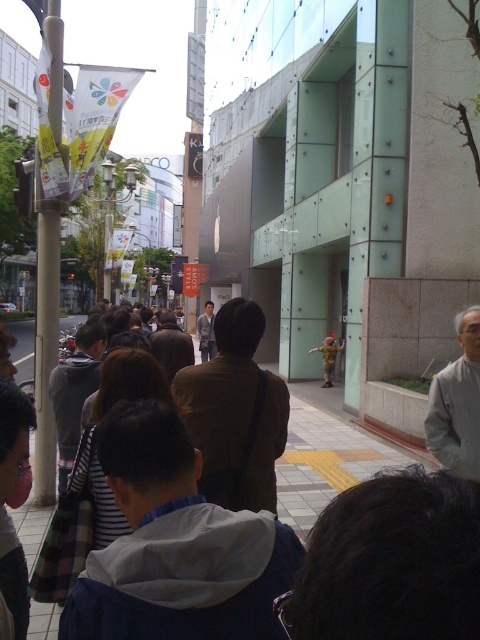
You are a delivery person standing at the edge of the street. You need to place a package on the smooth concrete pavement at center and then deliver it to the gray fabric jacket at lower right. Can you directly walk straight ahead from the pavement to reach the jacket without changing direction?

The smooth concrete pavement at center is closer to the viewer than gray fabric jacket at lower right, so you can walk straight ahead from the smooth concrete pavement at center towards the gray fabric jacket at lower right as it is further away in the scene.

You are a delivery person holding a package and need to reach the gray fabric jacket at lower right from the smooth concrete pavement at center. Can you walk directly to it without any obstacles?

The distance between the smooth concrete pavement at center and the gray fabric jacket at lower right is 36.12 feet, so yes, you can walk directly to it as there are no mentioned obstacles in the scene description.

You are standing at the entrance of the modern building with a glass facade and want to reach the smooth concrete pavement at center. Which direction should you walk to get there?

The smooth concrete pavement at center is located at point (x=325, y=458), so you should walk towards the center of the image to reach it.